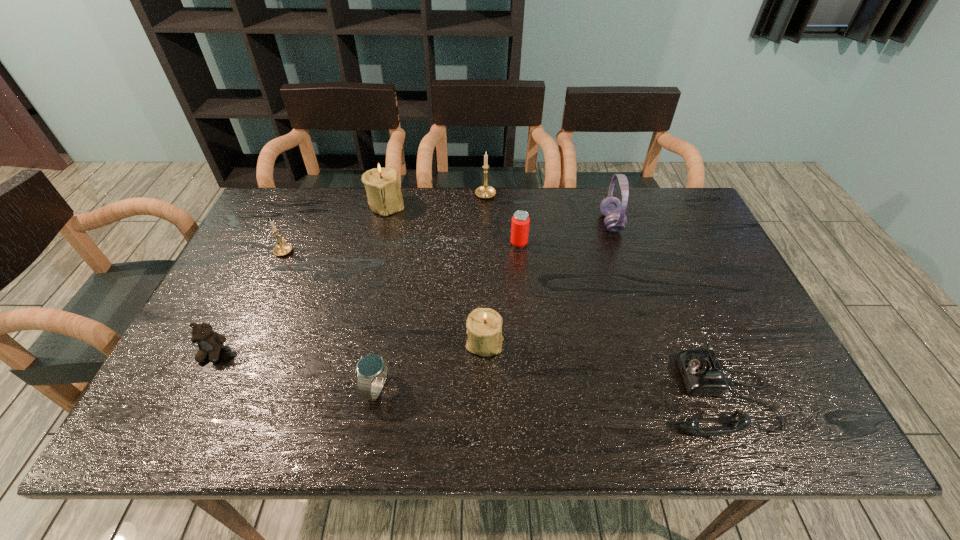
Image resolution: width=960 pixels, height=540 pixels. Find the location of `watch located at the near edge`. watch located at the near edge is located at coordinates (372, 369).

Image resolution: width=960 pixels, height=540 pixels. In order to click on telephone at the near edge in this screenshot , I will do `click(702, 374)`.

Image resolution: width=960 pixels, height=540 pixels. Find the location of `candle holder located at the left edge`. candle holder located at the left edge is located at coordinates (283, 248).

The image size is (960, 540). I want to click on teddy bear that is positioned at the left edge, so click(x=209, y=342).

Where is `object at the right edge`? object at the right edge is located at coordinates (702, 374).

This screenshot has height=540, width=960. I want to click on object located at the near right corner, so click(x=702, y=374).

Locate an element on the screen. This screenshot has height=540, width=960. vacant space at the far edge of the desktop is located at coordinates (361, 206).

Identify the location of free region at the near edge of the desktop. The height and width of the screenshot is (540, 960). (513, 413).

Locate an element on the screen. Image resolution: width=960 pixels, height=540 pixels. free region at the left edge of the desktop is located at coordinates (225, 380).

Where is `free space at the right edge`? The image size is (960, 540). free space at the right edge is located at coordinates (711, 254).